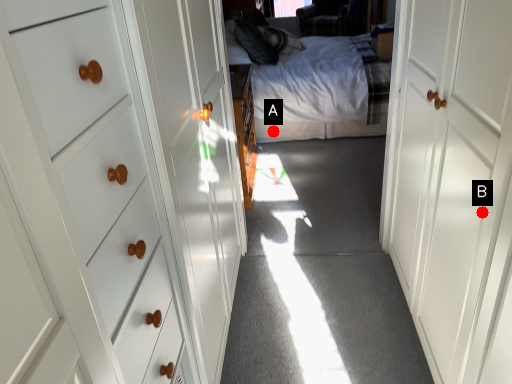
Question: Two points are circled on the image, labeled by A and B beside each circle. Which point is closer to the camera?

Choices:
 (A) A is closer
 (B) B is closer

Answer: (B)